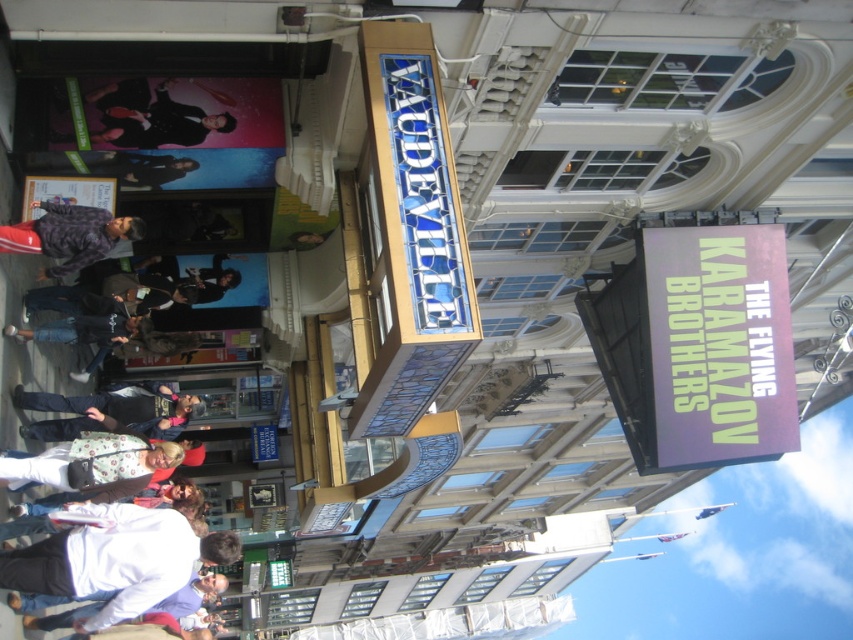
Can you confirm if floral fabric jacket at lower center is smaller than plaid fabric shirt at lower left?

Yes, floral fabric jacket at lower center is smaller than plaid fabric shirt at lower left.

Is point (73, 445) farther from viewer compared to point (67, 259)?

No, it is not.

Where is `floral fabric jacket at lower center`? The height and width of the screenshot is (640, 853). floral fabric jacket at lower center is located at coordinates (91, 464).

Which is in front, point (27, 356) or point (155, 108)?

Point (155, 108) is in front.

Is point (65, 368) in front of point (106, 140)?

No, it is not.

This screenshot has width=853, height=640. What do you see at coordinates (24, 346) in the screenshot?
I see `floral-patterned fabric at lower left` at bounding box center [24, 346].

The height and width of the screenshot is (640, 853). Identify the location of floral-patterned fabric at lower left. (24, 346).

Does shiny black suit at upper left appear on the right side of plaid fabric shirt at lower left?

Correct, you'll find shiny black suit at upper left to the right of plaid fabric shirt at lower left.

Who is taller, shiny black suit at upper left or plaid fabric shirt at lower left?

Standing taller between the two is shiny black suit at upper left.

Is point (160, 102) more distant than point (131, 227)?

Yes, it is.

Image resolution: width=853 pixels, height=640 pixels. I want to click on shiny black suit at upper left, so [151, 116].